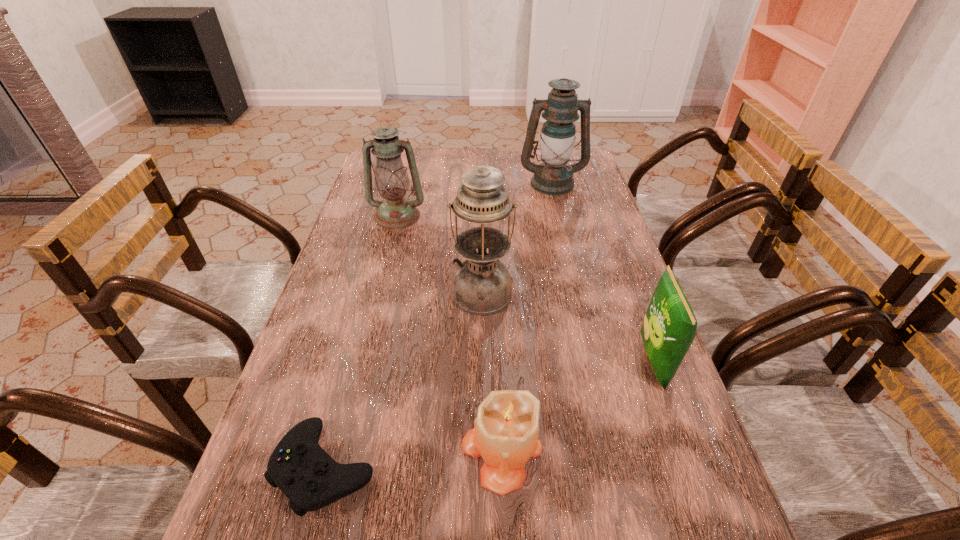
This screenshot has width=960, height=540. I want to click on free space between the control and the candle, so click(414, 458).

This screenshot has width=960, height=540. In order to click on free space between the fourth tallest object and the fifth tallest object in this screenshot , I will do `click(578, 406)`.

I want to click on free spot between the fourth nearest object and the crisp (potato chip), so click(568, 327).

Find the location of a particular element. This screenshot has width=960, height=540. free point between the third nearest object and the second nearest oil lamp is located at coordinates (525, 289).

Find the location of a particular element. The width and height of the screenshot is (960, 540). free space between the crisp (potato chip) and the second farthest object is located at coordinates (525, 289).

Where is `vacant area that lies between the second nearest oil lamp and the third nearest object`? The height and width of the screenshot is (540, 960). vacant area that lies between the second nearest oil lamp and the third nearest object is located at coordinates (525, 289).

Locate an element on the screen. free space between the second farthest oil lamp and the control is located at coordinates (361, 341).

Select which object is the fourth closest to the shortest object. Please provide its 2D coordinates. Your answer should be formatted as a tuple, i.e. [(x, y)], where the tuple contains the x and y coordinates of a point satisfying the conditions above.

[(395, 211)]

Point out which object is positioned as the third nearest to the farthest object. Please provide its 2D coordinates. Your answer should be formatted as a tuple, i.e. [(x, y)], where the tuple contains the x and y coordinates of a point satisfying the conditions above.

[(669, 327)]

The width and height of the screenshot is (960, 540). Find the location of `the closest oil lamp to the control`. the closest oil lamp to the control is located at coordinates (482, 285).